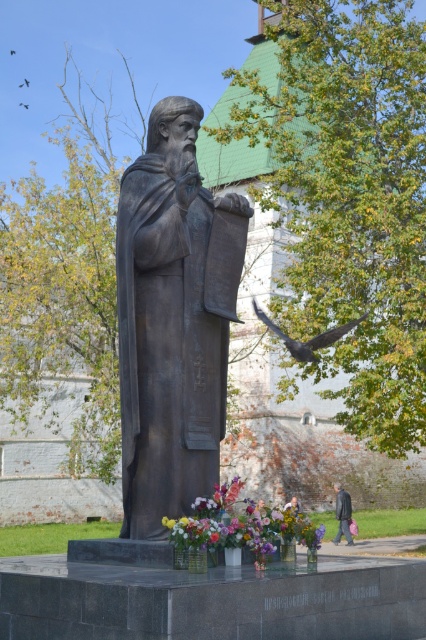
Between vibrant floral bouquet at center and dark gray coat at lower right, which one has more height?

With more height is vibrant floral bouquet at center.

Does vibrant floral bouquet at center appear on the left side of dark gray coat at lower right?

Indeed, vibrant floral bouquet at center is positioned on the left side of dark gray coat at lower right.

Locate an element on the screen. vibrant floral bouquet at center is located at coordinates (241, 524).

Identify the location of vibrant floral bouquet at center. Image resolution: width=426 pixels, height=640 pixels. (241, 524).

Between point (169, 401) and point (232, 541), which one is positioned behind?

The point (169, 401) is behind.

Is point (146, 518) in front of point (201, 516)?

No, (146, 518) is behind (201, 516).

This screenshot has width=426, height=640. Identify the location of bronze statue at center. (172, 321).

This screenshot has width=426, height=640. What are the coordinates of `bronze statue at center` in the screenshot? It's located at (172, 321).

Does point (164, 145) come closer to viewer compared to point (348, 522)?

That is True.

Who is shorter, bronze statue at center or dark gray coat at lower right?

Standing shorter between the two is bronze statue at center.

Between point (236, 202) and point (336, 538), which one is positioned behind?

The point (336, 538) is behind.

You are a GUI agent. You are given a task and a screenshot of the screen. Output one action in this format:
    pyautogui.click(x=<x>, y=<y>)
    Task: Click on the bronze statue at center
    This screenshot has height=640, width=426.
    Given the screenshot: What is the action you would take?
    pyautogui.click(x=172, y=321)